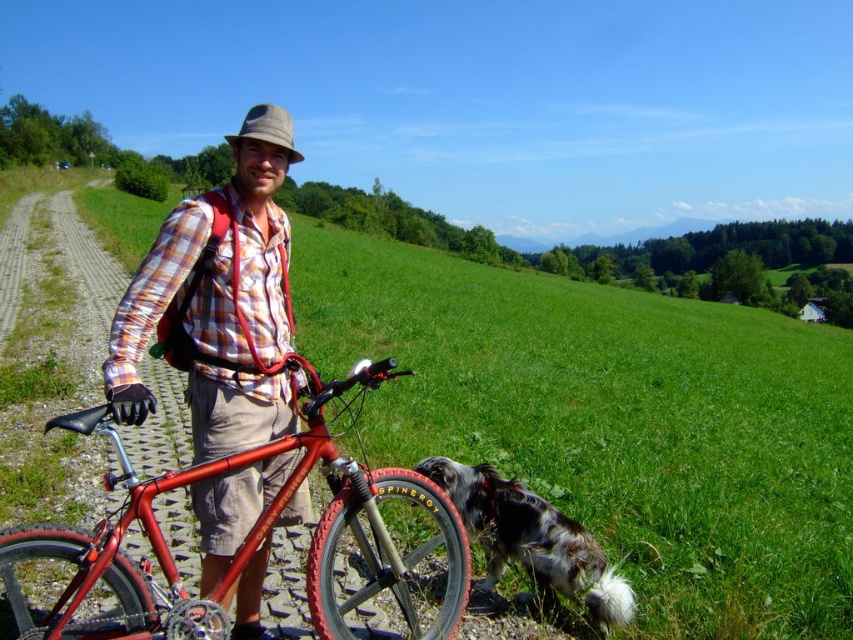
Question: Among these points, which one is farthest from the camera?

Choices:
 (A) (123, 307)
 (B) (450, 636)

Answer: (B)

Question: Is matte plaid shirt at center to the left of shiny metallic bicycle at left from the viewer's perspective?

Choices:
 (A) yes
 (B) no

Answer: (A)

Question: Which point appears farthest from the camera in this image?

Choices:
 (A) (206, 417)
 (B) (125, 628)

Answer: (A)

Question: Is smooth green grass at center to the right of matte plaid shirt at center from the viewer's perspective?

Choices:
 (A) yes
 (B) no

Answer: (A)

Question: In this image, where is matte plaid shirt at center located relative to black and white fur at lower right?

Choices:
 (A) right
 (B) left

Answer: (B)

Question: Based on their relative distances, which object is farther from the smooth green grass at center?

Choices:
 (A) black and white fur at lower right
 (B) matte plaid shirt at center
 (C) shiny metallic bicycle at left

Answer: (B)